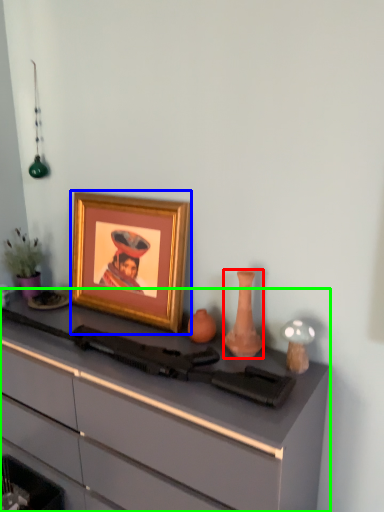
Question: Which object is the closest to the vase (highlighted by a red box)? Choose among these: picture frame (highlighted by a blue box) or desk (highlighted by a green box).

Choices:
 (A) picture frame
 (B) desk

Answer: (A)